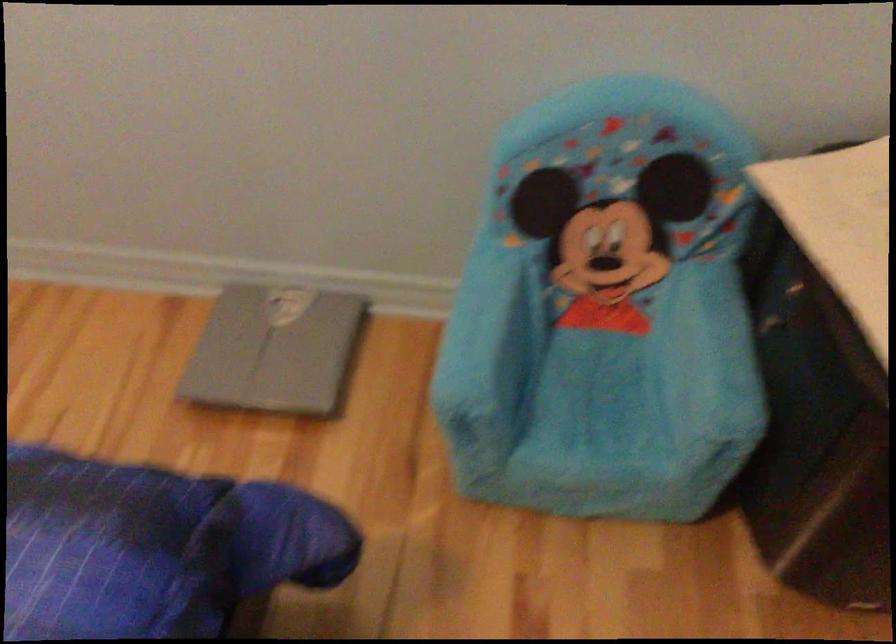
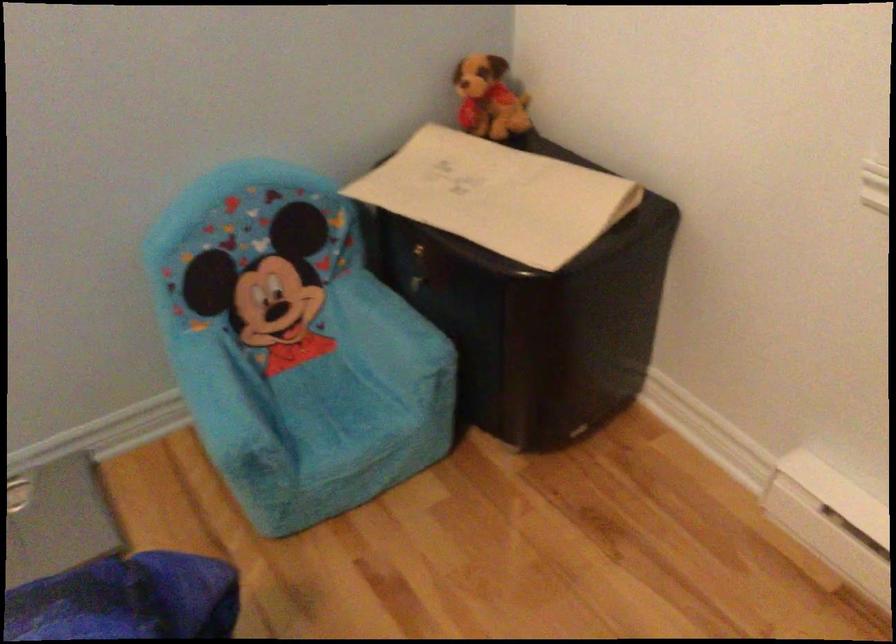
In the second image, find the point that corresponds to (627,412) in the first image.

(364, 402)